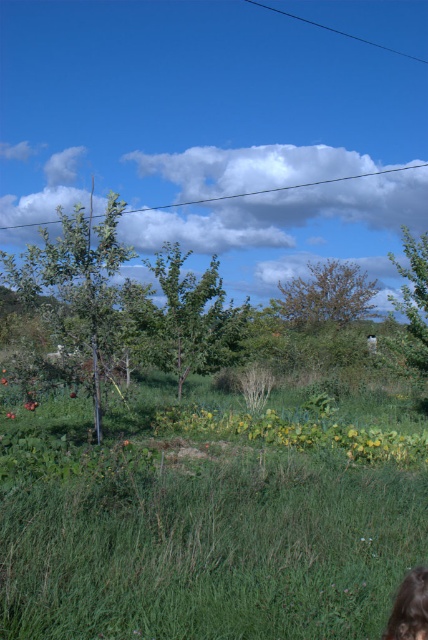
You are standing at the point marked by the coordinate point at (77, 280) in the image. Looking around, you see a green leafy tree at left. Which direction should you face to look towards the green leafy tree at left?

You should face towards the left direction to look towards the green leafy tree at left marked by the point at (77, 280).